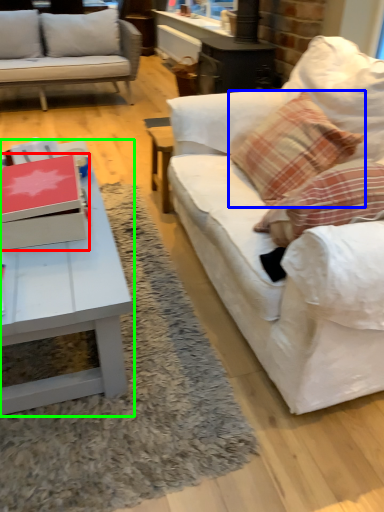
Question: Based on their relative distances, which object is nearer to box (highlighted by a red box)? Choose from pillow (highlighted by a blue box) and coffee table (highlighted by a green box).

Choices:
 (A) pillow
 (B) coffee table

Answer: (B)